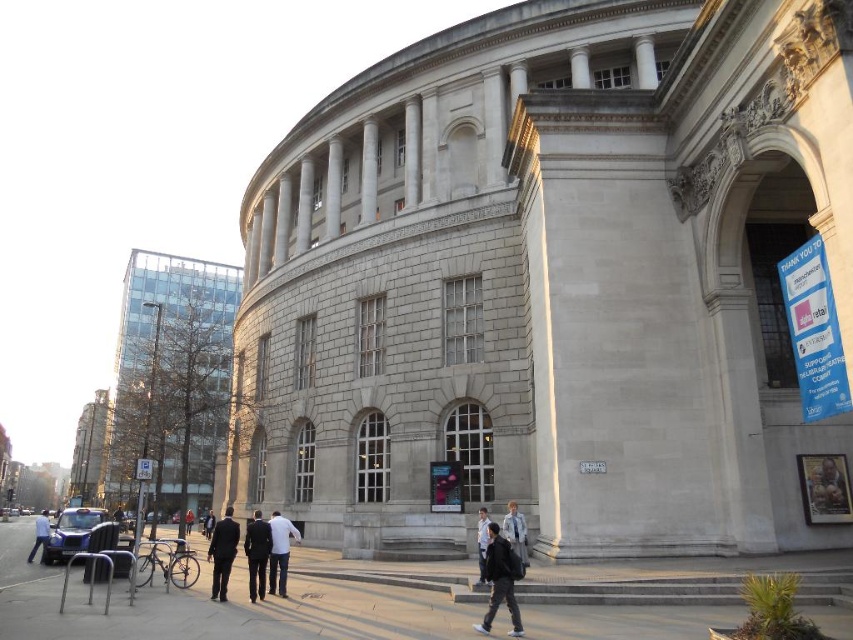
Question: Among these objects, which one is farthest from the camera?

Choices:
 (A) light blue fabric jacket at center
 (B) light blue shirt at center

Answer: (B)

Question: Which object appears closest to the camera in this image?

Choices:
 (A) dark gray jacket at lower center
 (B) light blue fabric jacket at center
 (C) red fabric jacket at center

Answer: (A)

Question: Considering the real-world distances, which object is farthest from the sandy beige pavement at lower center?

Choices:
 (A) dark suit at center
 (B) white matte shirt at center
 (C) black suit at lower left
 (D) dark blue jeans at lower left

Answer: (D)

Question: Can you confirm if sandy beige pavement at lower center is positioned above dark blue jeans at lower left?

Choices:
 (A) yes
 (B) no

Answer: (A)

Question: Is sandy beige pavement at lower center below dark blue jeans at lower left?

Choices:
 (A) no
 (B) yes

Answer: (A)

Question: Can you confirm if dark suit at center is bigger than red fabric jacket at center?

Choices:
 (A) yes
 (B) no

Answer: (A)